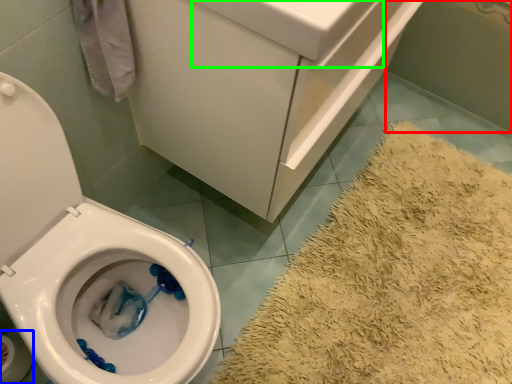
Question: Which object is positioned farthest from bath (highlighted by a red box)? Select from toilet paper (highlighted by a blue box) and sink (highlighted by a green box).

Choices:
 (A) toilet paper
 (B) sink

Answer: (A)